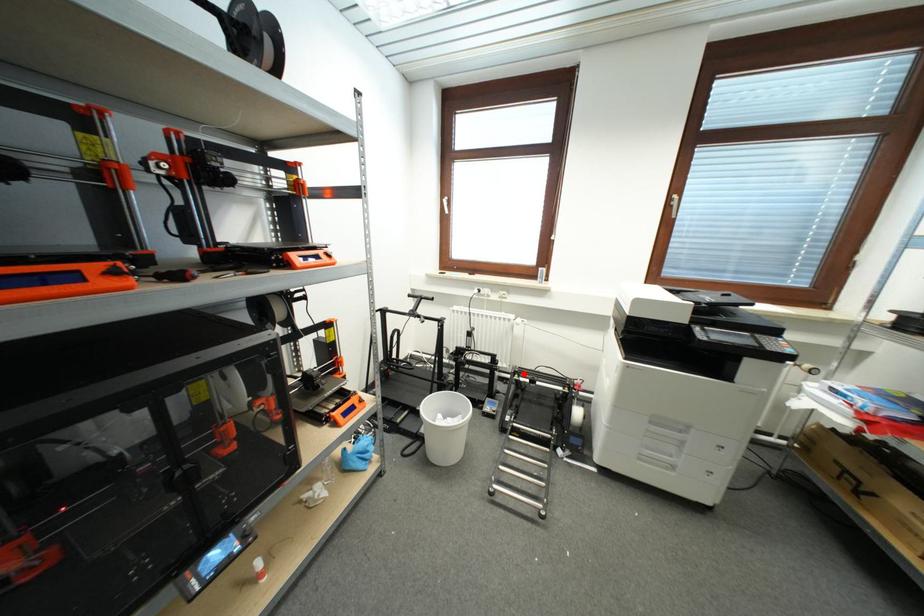
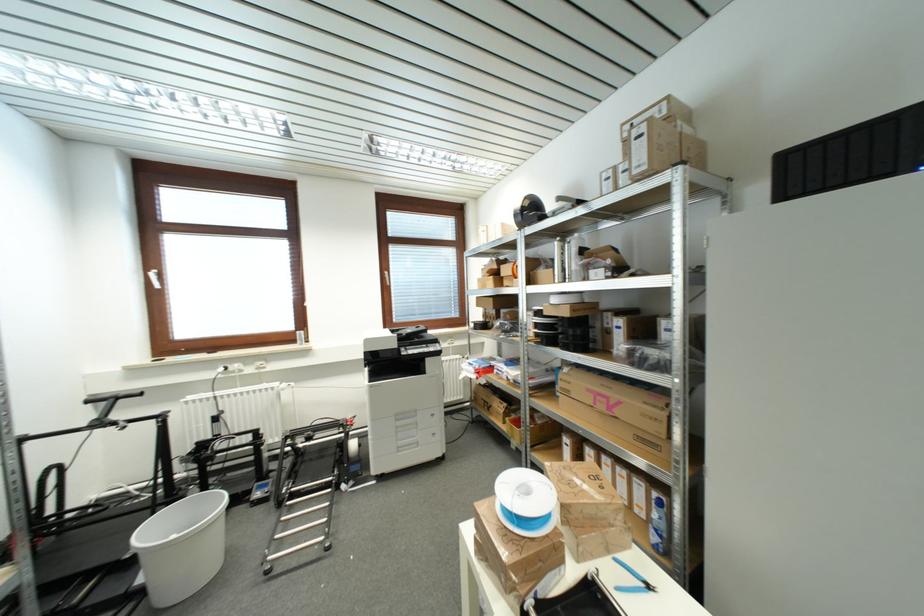
Question: I am providing you with two images of the same scene from different viewpoints. Given a red point in image1, look at the same physical point in image2. Is it:

Choices:
 (A) Closer to the viewpoint
 (B) Farther from the viewpoint

Answer: (B)